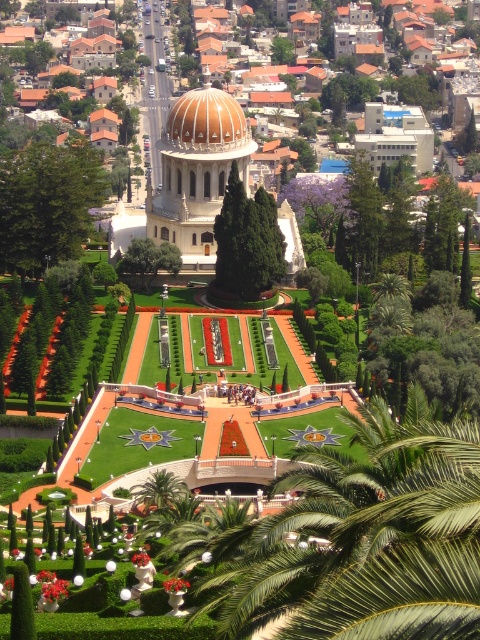
You are standing at the central plaza in the Bahai Gardens and want to take a photo of the green leafy palm tree at center. According to the coordinates provided, in which direction should you face to capture the tree in your shot?

The green leafy palm tree at center is located at coordinates point (367, 538). Since the central plaza is at the lower part of the image, facing towards the upper right direction would allow you to capture the tree in your shot.

Based on the photo, you are standing at the point labeled as point (367, 538) in the Bahai Gardens. Which object are you currently located on?

The point (367, 538) is located on the green leafy palm tree at center.

You are standing at the central plaza in the Bahai Gardens and want to find the green leafy palm tree at center. According to the coordinates given, in which direction should you walk from the central plaza to locate it?

The green leafy palm tree at center is located at coordinates point (367,538). Since the central plaza is at the origin, you should walk towards the direction of the coordinates to find it.